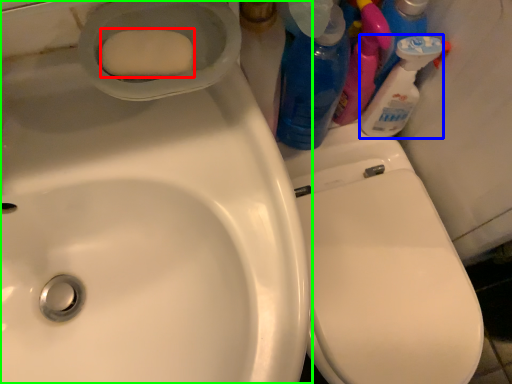
Question: Estimate the real-world distances between objects in this image. Which object is farther from soap (highlighted by a red box), cleaning product (highlighted by a blue box) or sink (highlighted by a green box)?

Choices:
 (A) cleaning product
 (B) sink

Answer: (A)